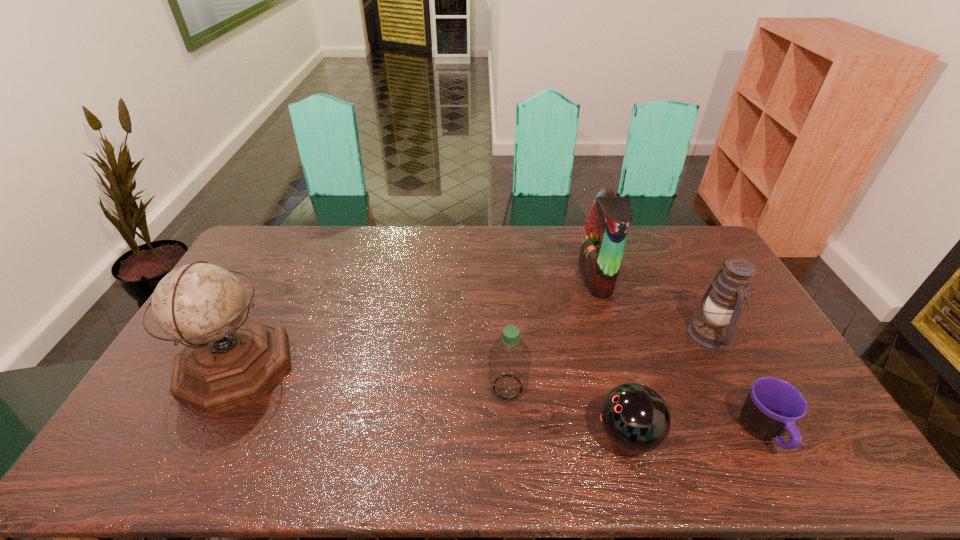
What are the coordinates of `the leftmost object` in the screenshot? It's located at (229, 361).

Find the location of a particular element. Image resolution: width=960 pixels, height=540 pixels. parrot is located at coordinates (601, 252).

This screenshot has height=540, width=960. Identify the location of oil lamp. (722, 304).

This screenshot has height=540, width=960. Find the location of `the fifth object from right to left`. the fifth object from right to left is located at coordinates (509, 360).

The image size is (960, 540). In order to click on water bottle in this screenshot , I will do `click(509, 360)`.

You are a GUI agent. You are given a task and a screenshot of the screen. Output one action in this format:
    pyautogui.click(x=<x>, y=<y>)
    Task: Click on the fifth tallest object
    This screenshot has height=540, width=960.
    Given the screenshot: What is the action you would take?
    pyautogui.click(x=635, y=418)

This screenshot has height=540, width=960. What are the coordinates of `mug` in the screenshot? It's located at pyautogui.click(x=773, y=406).

Locate an element on the screen. This screenshot has height=540, width=960. vacant position located 0.390m on the surface of the globe is located at coordinates (424, 366).

This screenshot has width=960, height=540. Find the location of `vacant space situated at the face of the parrot`. vacant space situated at the face of the parrot is located at coordinates (497, 277).

Find the location of a particular element. free space located at the face of the parrot is located at coordinates (481, 277).